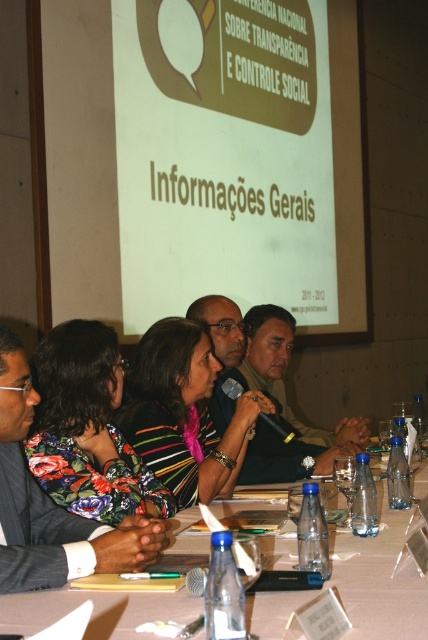
Can you confirm if white plastic table at center is bigger than dark suit at center?

No.

Between white plastic table at center and dark suit at center, which one has less height?

With less height is white plastic table at center.

Where is `white plastic table at center`? Image resolution: width=428 pixels, height=640 pixels. white plastic table at center is located at coordinates (380, 580).

Is striped fabric at center above dark suit at center?

Yes.

Is striped fabric at center to the right of dark suit at center from the viewer's perspective?

Indeed, striped fabric at center is positioned on the right side of dark suit at center.

The image size is (428, 640). Identify the location of striped fabric at center. (184, 412).

Can you confirm if dark suit at center is positioned above matte black microphone at center?

Actually, dark suit at center is below matte black microphone at center.

Is dark suit at center to the right of matte black microphone at center from the viewer's perspective?

Incorrect, dark suit at center is not on the right side of matte black microphone at center.

Identify the location of dark suit at center. (51, 504).